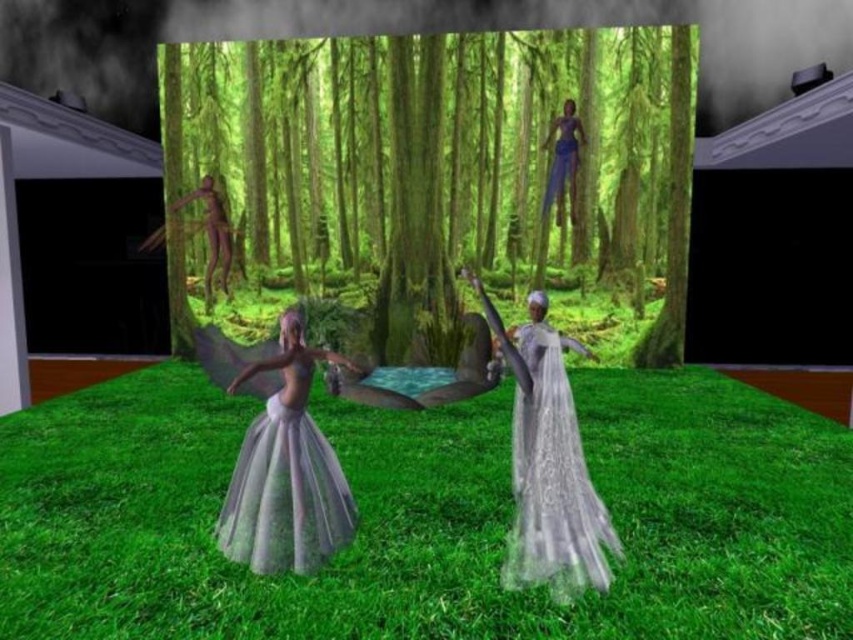
Consider the image. You are standing in the fantasy scene described. There is a point labeled as point (427,516). What object is located at this point?

The point (427,516) corresponds to the green grass at center.

You are a photographer trying to capture the scene with a wide angle lens. You notice the green grass at center and the translucent white dress at center. Which object will appear larger in the photo?

The green grass at center will appear larger in the photo because it is closer to the viewer than the translucent white dress at center.

Based on the photo, you are an observer standing in the scene. You see the green grass at center and the green matte tree at center. Which object is nearer to you?

The green grass at center is closer to the viewer than the green matte tree at center.